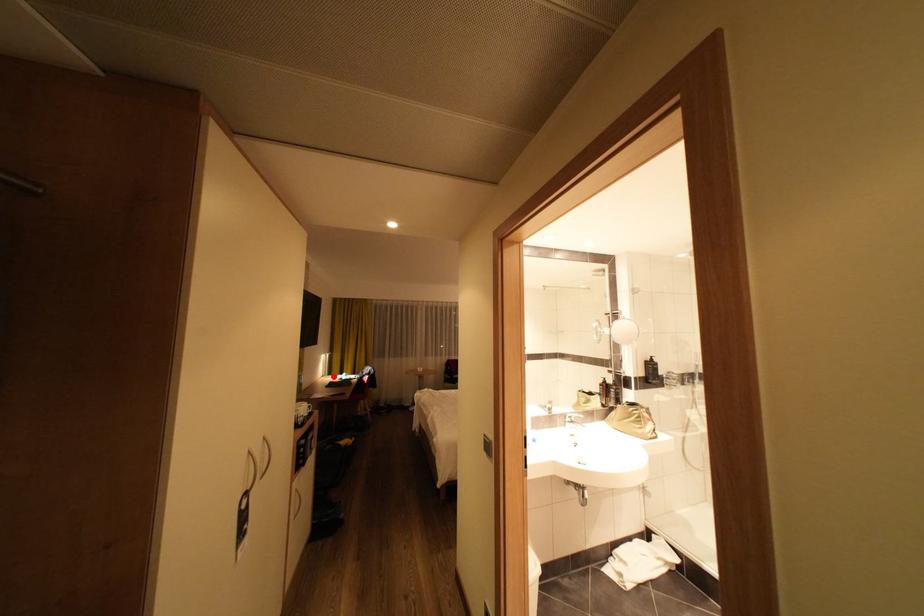
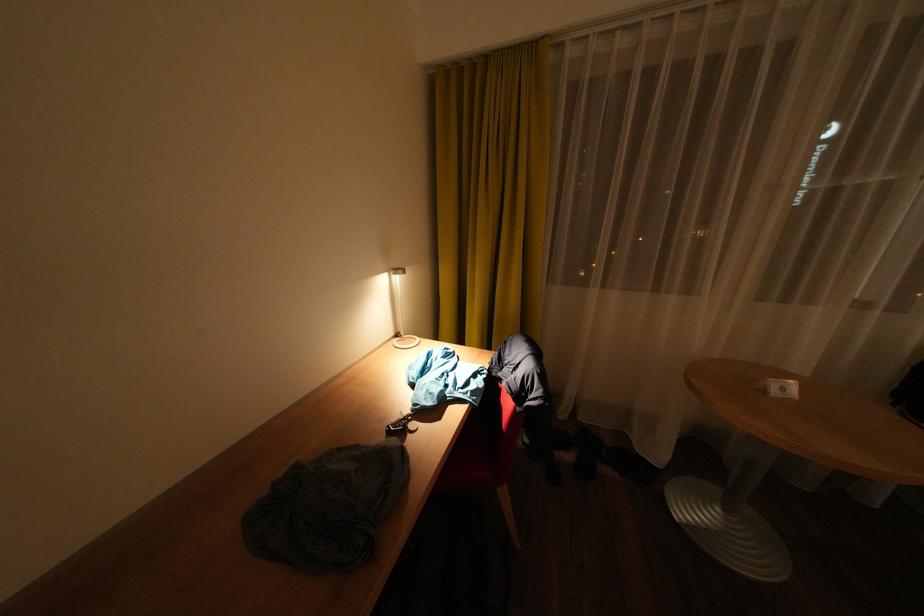
Question: I am providing you with two images of the same scene from different viewpoints. Image1 has a red point marked. In image2, the corresponding 3D location appears at what relative position? Reply with the corresponding letter.

Choices:
 (A) Closer
 (B) Farther

Answer: (A)